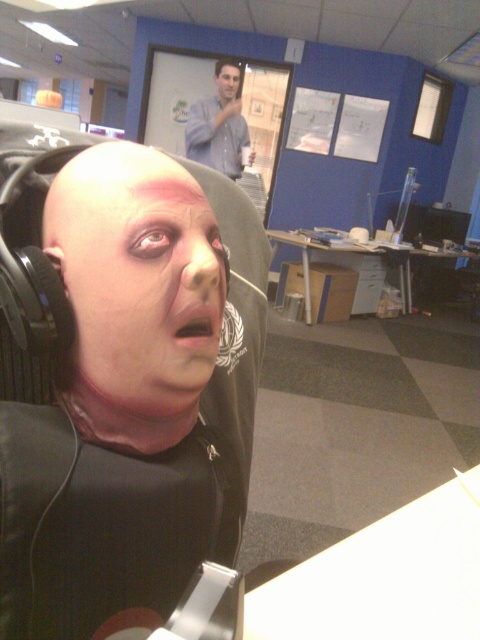
Question: Which point is closer to the camera?

Choices:
 (A) (229, 92)
 (B) (183, 300)

Answer: (B)

Question: Is blue shirt at upper center to the left of matte black head at upper center from the viewer's perspective?

Choices:
 (A) no
 (B) yes

Answer: (B)

Question: Considering the relative positions of matte black mask at center and matte black face at center in the image provided, where is matte black mask at center located with respect to matte black face at center?

Choices:
 (A) below
 (B) above

Answer: (A)

Question: Estimate the real-world distances between objects in this image. Which object is farther from the matte black face at center?

Choices:
 (A) matte black mask at center
 (B) matte black head at upper center

Answer: (B)

Question: Does blue shirt at upper center appear over matte black head at upper center?

Choices:
 (A) no
 (B) yes

Answer: (A)

Question: Estimate the real-world distances between objects in this image. Which object is farther from the blue shirt at upper center?

Choices:
 (A) matte black head at upper center
 (B) matte black mask at center
 (C) matte black face at center

Answer: (C)